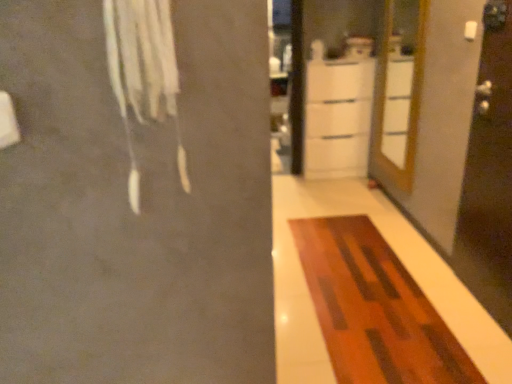
Question: Would you say wooden at right contains white fabric at upper left?

Choices:
 (A) yes
 (B) no

Answer: (B)

Question: Is wooden at right bigger than white fabric at upper left?

Choices:
 (A) no
 (B) yes

Answer: (B)

Question: From the image's perspective, does wooden at right appear lower than white fabric at upper left?

Choices:
 (A) yes
 (B) no

Answer: (B)

Question: Does wooden at right touch white fabric at upper left?

Choices:
 (A) no
 (B) yes

Answer: (A)

Question: From the image's perspective, is wooden at right above white fabric at upper left?

Choices:
 (A) no
 (B) yes

Answer: (B)

Question: Choose the correct answer: Is wooden rug at center inside wooden at right or outside it?

Choices:
 (A) outside
 (B) inside

Answer: (A)

Question: Considering the positions of wooden rug at center and wooden at right in the image, is wooden rug at center wider or thinner than wooden at right?

Choices:
 (A) thin
 (B) wide

Answer: (B)

Question: Is wooden rug at center taller or shorter than wooden at right?

Choices:
 (A) short
 (B) tall

Answer: (A)

Question: In the image, is wooden rug at center on the left side or the right side of wooden at right?

Choices:
 (A) left
 (B) right

Answer: (A)

Question: Is transparent glass screen door at right situated inside white glossy cabinet at center or outside?

Choices:
 (A) inside
 (B) outside

Answer: (B)

Question: Relative to white glossy cabinet at center, is transparent glass screen door at right in front or behind?

Choices:
 (A) front
 (B) behind

Answer: (A)

Question: From the image's perspective, is transparent glass screen door at right above or below white glossy cabinet at center?

Choices:
 (A) above
 (B) below

Answer: (B)

Question: Looking at their shapes, would you say transparent glass screen door at right is wider or thinner than white glossy cabinet at center?

Choices:
 (A) wide
 (B) thin

Answer: (B)

Question: Which is correct: white glossy cabinet at center is inside wooden at right, or outside of it?

Choices:
 (A) outside
 (B) inside

Answer: (A)

Question: Considering the positions of white glossy cabinet at center and wooden at right in the image, is white glossy cabinet at center wider or thinner than wooden at right?

Choices:
 (A) wide
 (B) thin

Answer: (A)